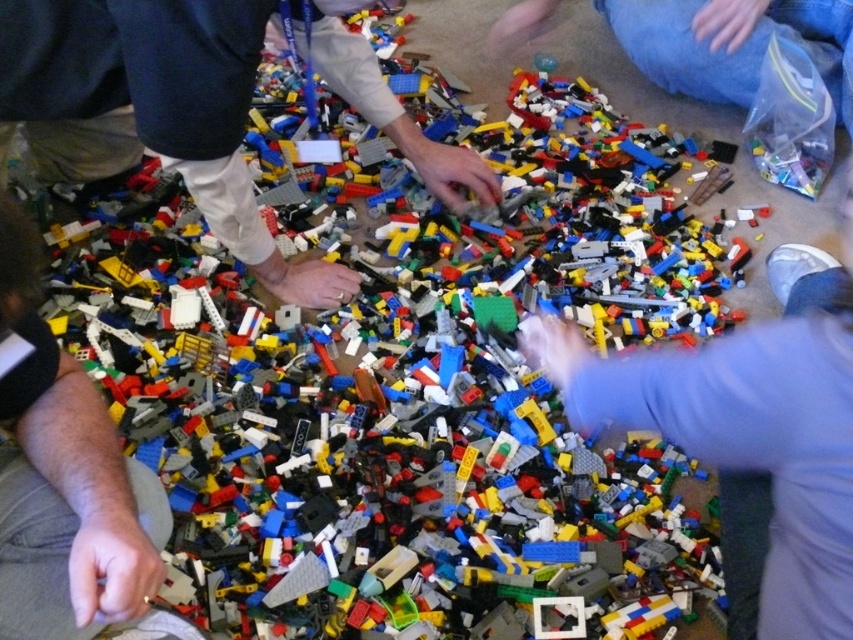
Question: Which object is positioned farthest from the smooth plastic hand at center?

Choices:
 (A) dark gray fabric hand at lower left
 (B) matte white pants at center
 (C) blue jeans at upper right

Answer: (C)

Question: From the image, what is the correct spatial relationship of smooth plastic hand at center in relation to dark gray fabric hand at lower left?

Choices:
 (A) right
 (B) left

Answer: (A)

Question: Can you confirm if matte white pants at center is smaller than smooth plastic hand at center?

Choices:
 (A) yes
 (B) no

Answer: (B)

Question: Which of the following is the closest to the observer?

Choices:
 (A) matte white pants at center
 (B) blue jeans at upper right

Answer: (A)

Question: Does smooth plastic hand at center have a smaller size compared to dark gray fabric hand at lower left?

Choices:
 (A) yes
 (B) no

Answer: (B)

Question: Which point appears farthest from the camera in this image?

Choices:
 (A) (13, 317)
 (B) (664, 68)
 (C) (828, 500)

Answer: (B)